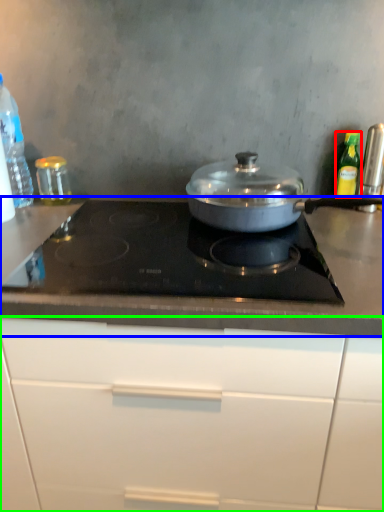
Question: Estimate the real-world distances between objects in this image. Which object is farther from kitchen appliance (highlighted by a red box), countertop (highlighted by a blue box) or cabinetry (highlighted by a green box)?

Choices:
 (A) countertop
 (B) cabinetry

Answer: (B)